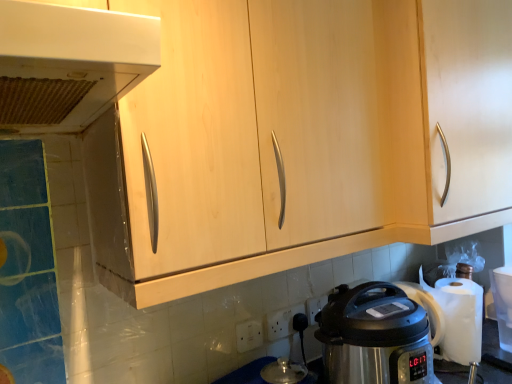
Question: Does point (471, 190) appear closer or farther from the camera than point (311, 311)?

Choices:
 (A) closer
 (B) farther

Answer: (A)

Question: In the image, is light wood cabinet at center positioned in front of or behind white plastic electric outlet at lower center, positioned as the 1th electric outlet in right-to-left order?

Choices:
 (A) front
 (B) behind

Answer: (A)

Question: Based on their relative distances, which object is nearer to the white plastic range hood at upper left?

Choices:
 (A) stainless steel pressure cooker at lower right
 (B) light wood cabinet at center
 (C) white plastic electric outlet at lower center, which appears as the first electric outlet when viewed from the front
 (D) white plastic electric outlet at lower center, placed as the 2th electric outlet when sorted from right to left
 (E) white plastic electric outlet at lower center, positioned as the 1th electric outlet in right-to-left order

Answer: (B)

Question: Estimate the real-world distances between objects in this image. Which object is farther from the white plastic electric outlet at lower center, which is the third electric outlet in front-to-back order?

Choices:
 (A) light wood cabinet at center
 (B) white plastic electric outlet at lower center, placed as the 2th electric outlet when sorted from right to left
 (C) white plastic electric outlet at lower center, acting as the third electric outlet starting from the right
 (D) stainless steel pressure cooker at lower right
 (E) white plastic range hood at upper left

Answer: (E)